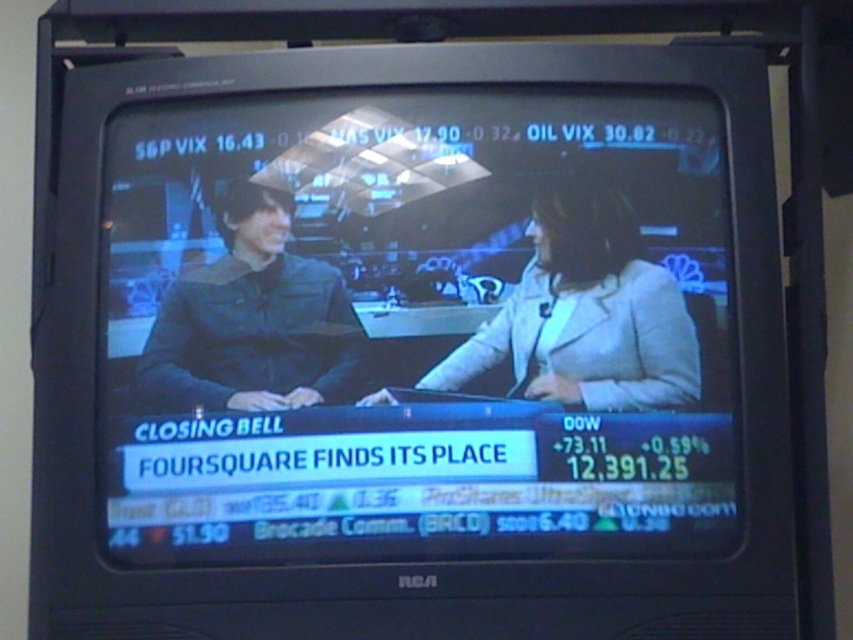
Is matte black monitor at center taller than light gray suit at center?

Yes.

Based on the photo, between matte black monitor at center and light gray suit at center, which one is positioned higher?

light gray suit at center

What do you see at coordinates (416, 326) in the screenshot? This screenshot has height=640, width=853. I see `matte black monitor at center` at bounding box center [416, 326].

Locate an element on the screen. matte black monitor at center is located at coordinates pos(416,326).